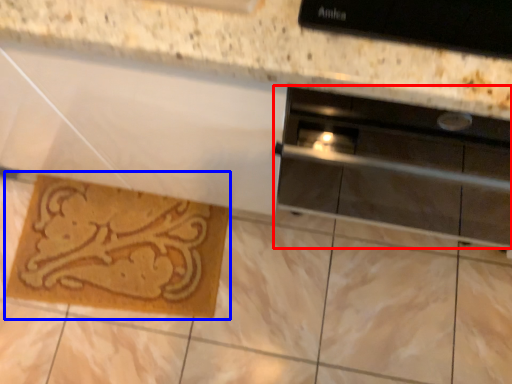
Question: Which point is closer to the camera, home appliance (highlighted by a red box) or doormat (highlighted by a blue box)?

Choices:
 (A) home appliance
 (B) doormat

Answer: (A)